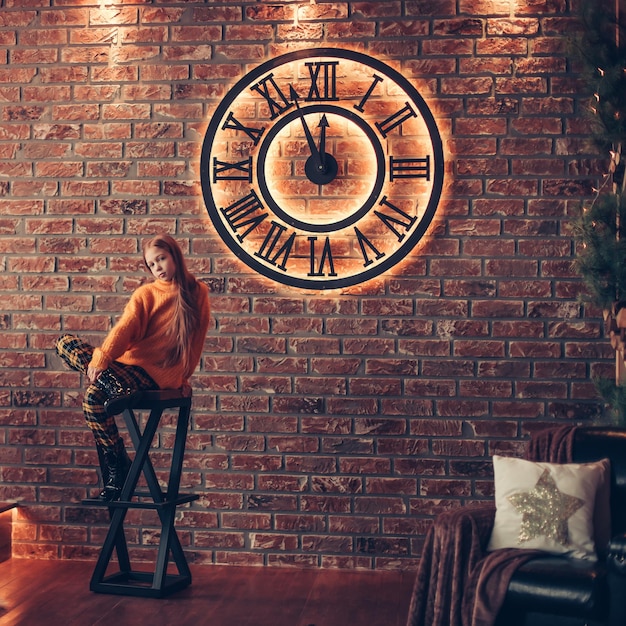
This screenshot has width=626, height=626. I want to click on hardwood floor in front of brick wall, so click(x=393, y=595), click(x=307, y=585), click(x=238, y=613), click(x=146, y=612), click(x=44, y=606), click(x=19, y=570).